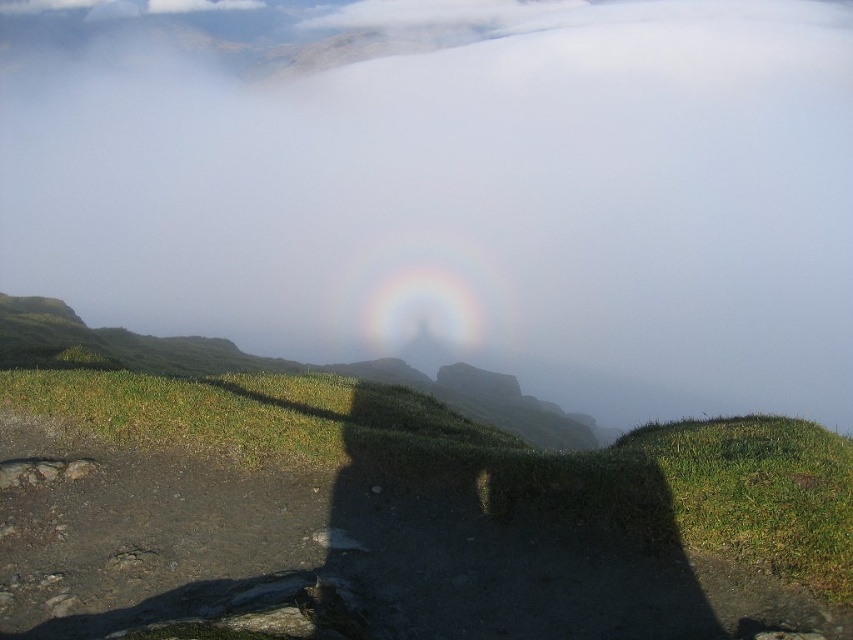
From the picture: Which is below, transparent mist at center or green grassy hill at lower right?

Positioned lower is green grassy hill at lower right.

Does point (122, 33) lie in front of point (747, 556)?

That is False.

This screenshot has width=853, height=640. I want to click on transparent mist at center, so click(x=451, y=188).